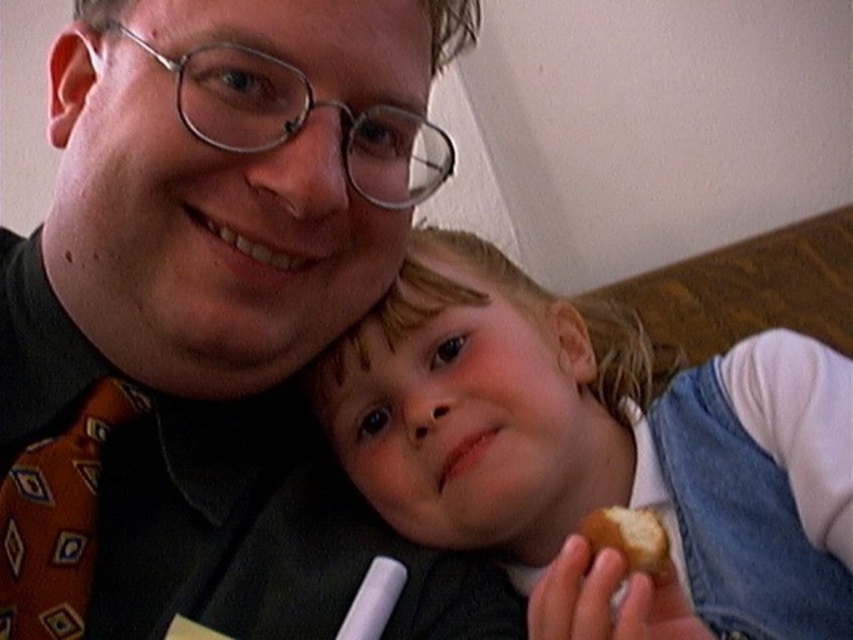
You are a photographer setting up a portrait session. You notice two shirts in the frame, the matte black shirt at center and the smooth white shirt at center. Which shirt should you adjust to ensure proper focus if the camera is focused on the upper part of the frame?

The matte black shirt at center is located above the smooth white shirt at center, so adjusting the matte black shirt at center would ensure proper focus since it is in the upper part of the frame where the camera is focused.

You are a photographer who wants to capture the orange patterned tie at left and the golden crumbly pastry at lower right in the same frame. Based on their sizes, which object should you focus on first to ensure both are in focus?

The orange patterned tie at left has a greater height compared to the golden crumbly pastry at lower right, so you should focus on the orange patterned tie at left first to ensure both are in focus since it is larger and requires more attention.

You are a photographer setting up a shoot. You have a matte black shirt at center and a golden crumbly pastry at lower right in your frame. To ensure both subjects are in focus, you need to adjust your camera settings. Considering their sizes, which object should you prioritize focusing on first?

The matte black shirt at center should be prioritized for focusing first because it is much taller than the golden crumbly pastry at lower right, making it the primary subject in terms of size and likely importance in the composition.